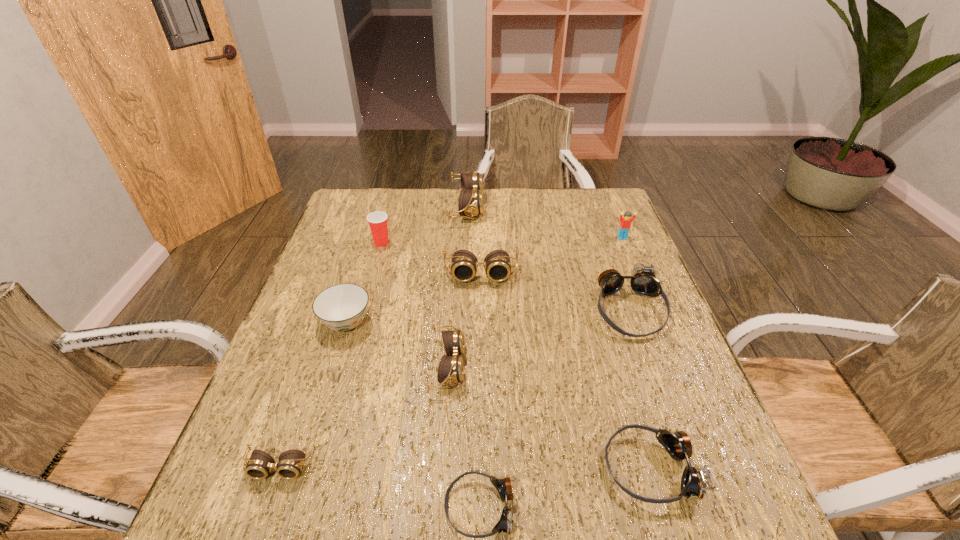
The image size is (960, 540). I want to click on the second closest bronze goggles to the nearest brown goggles, so click(x=693, y=483).

Locate an element on the screen. The image size is (960, 540). vacant space that satisfies the following two spatial constraints: 1. through the lenses of the third farthest brown goggles; 2. through the lenses of the leftmost goggles is located at coordinates (441, 467).

Locate an element on the screen. vacant space that satisfies the following two spatial constraints: 1. on the back side of the red Dixie cup; 2. on the right side of the soup bowl is located at coordinates (x=372, y=242).

The height and width of the screenshot is (540, 960). I want to click on free location that satisfies the following two spatial constraints: 1. through the lenses of the farthest bronze goggles; 2. through the lenses of the second smallest bronze goggles, so click(685, 468).